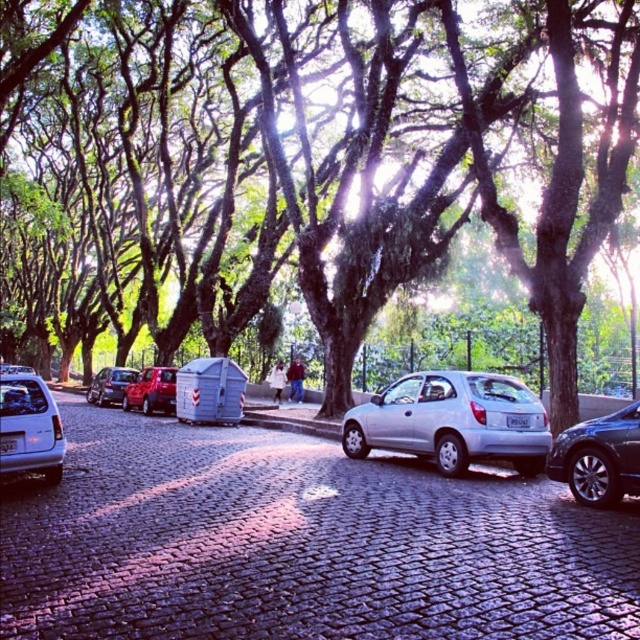
Can you confirm if silver metallic car at center is positioned above shiny black sedan at right?

No.

Who is higher up, silver metallic car at center or shiny black sedan at right?

Positioned higher is shiny black sedan at right.

Measure the distance between silver metallic car at center and camera.

silver metallic car at center and camera are 13.77 feet apart.

Identify the location of silver metallic car at center. (298, 544).

Is point (566, 480) positioned in front of point (54, 410)?

Yes, point (566, 480) is closer to viewer.

Is point (577, 496) positioned behind point (45, 474)?

No, it is not.

Who is more distant from viewer, [618,422] or [1,416]?

The point [1,416] is behind.

You are a GUI agent. You are given a task and a screenshot of the screen. Output one action in this format:
    pyautogui.click(x=<x>, y=<y>)
    Task: Click on the shiny black sedan at right
    
    Given the screenshot: What is the action you would take?
    pyautogui.click(x=598, y=458)

Is shiny black sedan at right to the right of shiny red car at center from the viewer's perspective?

Yes, shiny black sedan at right is to the right of shiny red car at center.

The height and width of the screenshot is (640, 640). Find the location of `shiny black sedan at right`. shiny black sedan at right is located at coordinates (598, 458).

The height and width of the screenshot is (640, 640). What are the coordinates of `shiny black sedan at right` in the screenshot? It's located at (598, 458).